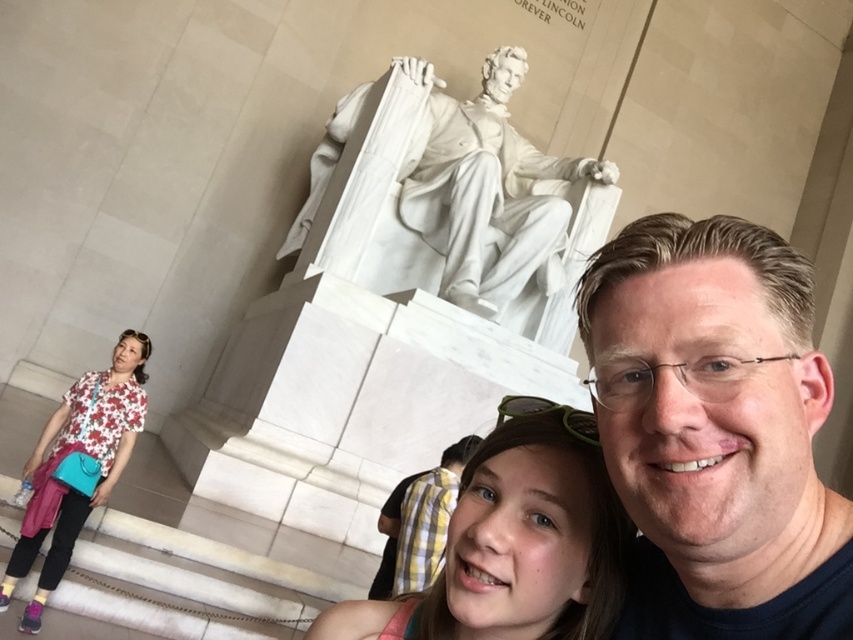
Question: In this image, where is matte white statue at center located relative to white marble statue at center?

Choices:
 (A) right
 (B) left

Answer: (A)

Question: Observing the image, what is the correct spatial positioning of white marble statue at center in reference to floral fabric shirt at lower center?

Choices:
 (A) above
 (B) below

Answer: (A)

Question: Among these points, which one is farthest from the camera?

Choices:
 (A) (737, 433)
 (B) (111, 452)

Answer: (B)

Question: Which object is the closest to the matte white statue at center?

Choices:
 (A) floral fabric shirt at lower center
 (B) white marble statue at center
 (C) floral fabric blouse at lower left

Answer: (A)

Question: Among these objects, which one is nearest to the camera?

Choices:
 (A) matte white statue at center
 (B) white marble statue at center
 (C) floral fabric shirt at lower center

Answer: (A)

Question: Can you confirm if floral fabric shirt at lower center is thinner than floral fabric blouse at lower left?

Choices:
 (A) no
 (B) yes

Answer: (A)